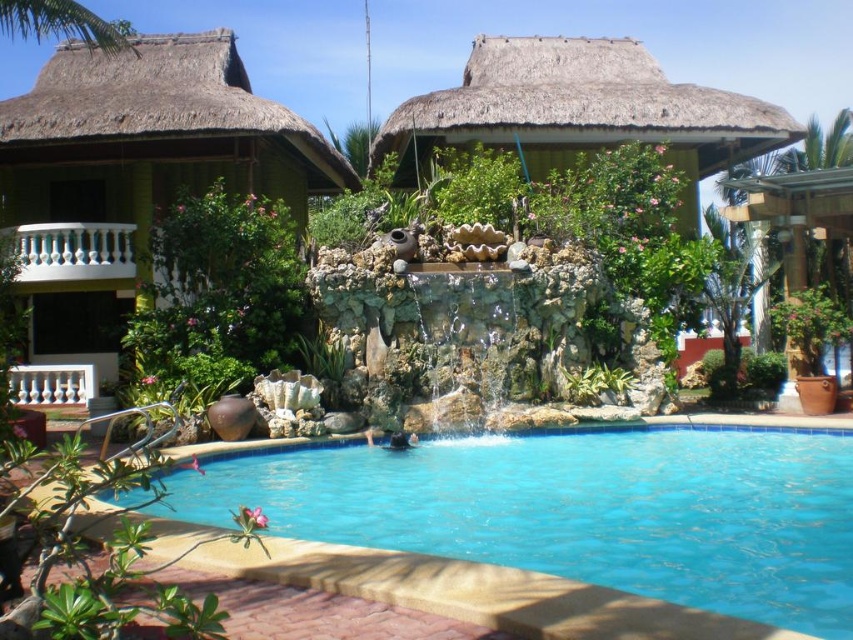
You are planning to take a photo of the blue tile swimming pool at center and the green thatched roof hut at left. Which object should you position closer to the left side of your camera frame?

The green thatched roof hut at left should be positioned closer to the left side of your camera frame since it is located to the left of the blue tile swimming pool at center.

You are a tourist staying at the resort and want to take a photo of the blue tile swimming pool at center and the green thatched roof hut at left together in the same frame. Your camera has a maximum zoom range of 10 meters. Can you capture both objects in one photo without moving your position?

The blue tile swimming pool at center is 12.93 meters away from the green thatched roof hut at left. Since the distance between them exceeds the camera maximum zoom range of 10 meters, you cannot capture both objects in the same photo without moving your position.

You are a tourist standing in front of the swimming pool and want to take a photo of both the green thatched roof hut at left and the natural thatched roof hut at center. Which direction should you face to include both in your photo?

You should face towards the right side of the natural thatched roof hut at center to include both the green thatched roof hut at left and the natural thatched roof hut at center in your photo, since the green thatched roof hut at left is positioned on the left side of the natural thatched roof hut at center.